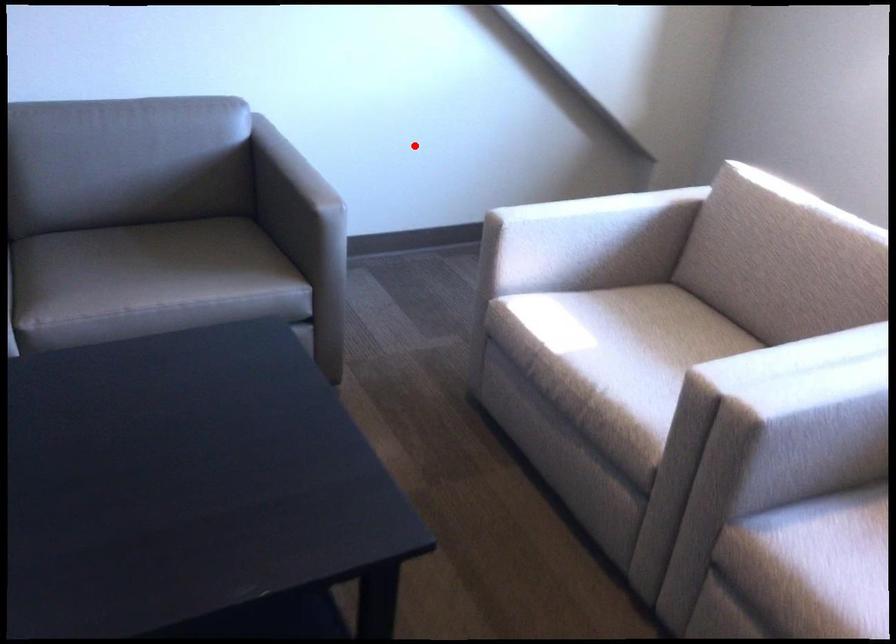
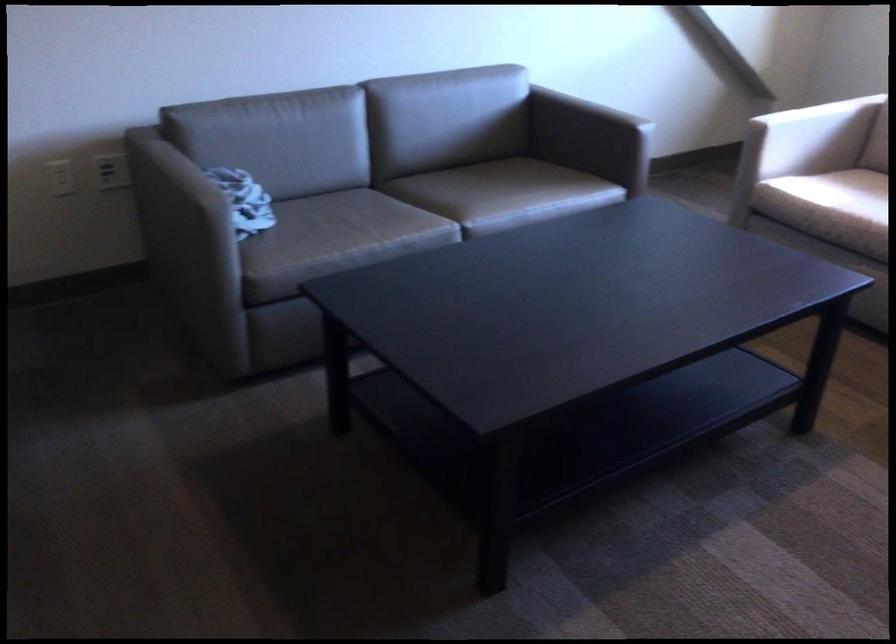
Find the pixel in the second image that matches the highlighted location in the first image.

(605, 93)